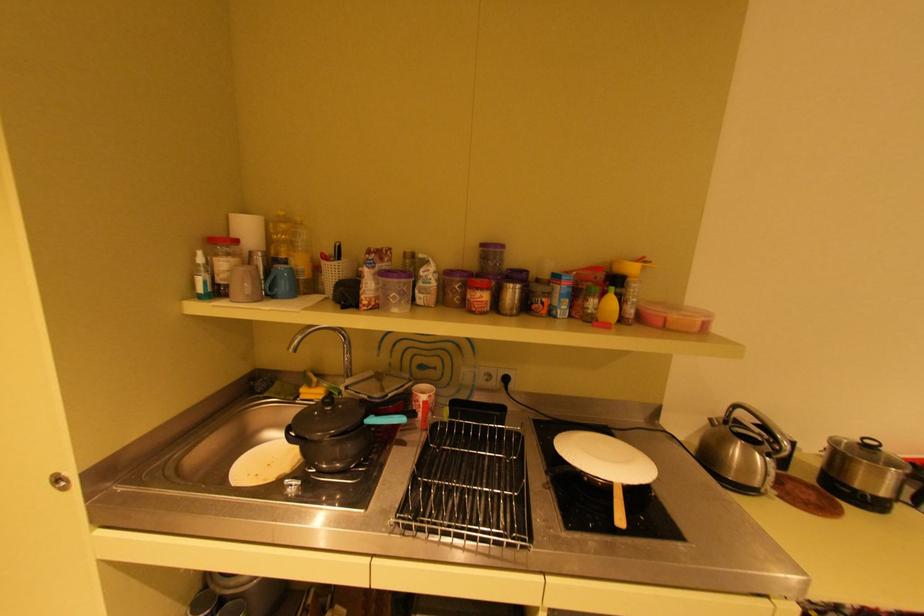
At what (x,y) coordinates should I click in order to perform the action: click on white spray bottle. Please return your answer as a coordinate pair (x, y). This screenshot has height=616, width=924. Looking at the image, I should click on (201, 277).